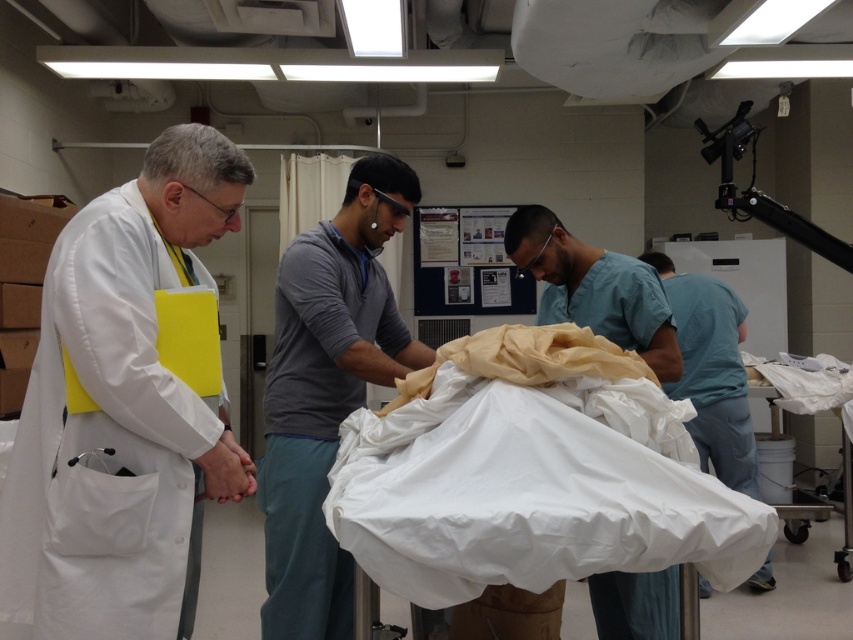
You are a visitor in this medical facility and need to locate the person in teal scrubs at center. From your perspective, which direction should you look relative to the white matte lab coat at left?

The white matte lab coat at left is in front of the teal scrubs at center, so to locate the teal scrubs at center, you should look behind the white matte lab coat at left.

You are a medical student observing a procedure in a clinical setting. You notice an object at point (x=595, y=289). What is the object located at that coordinate?

The object at point (x=595, y=289) is blue scrubs at center.